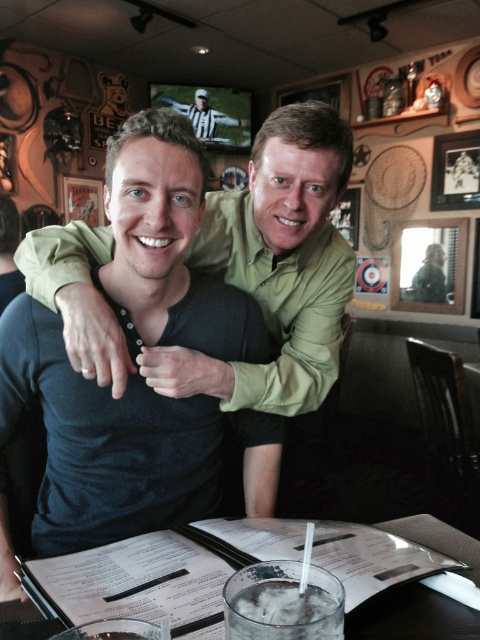
You are a photographer taking a picture of the scene. You notice the green matte shirt at center and the clear plastic cup at center. Which object is larger in the photo?

The green matte shirt at center is bigger than the clear plastic cup at center, so the green matte shirt at center appears larger in the photo.